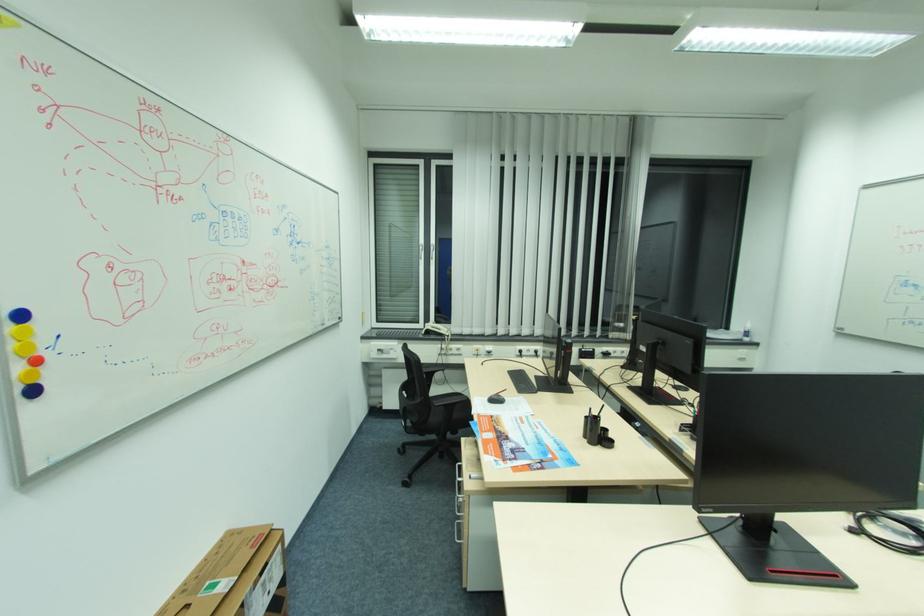
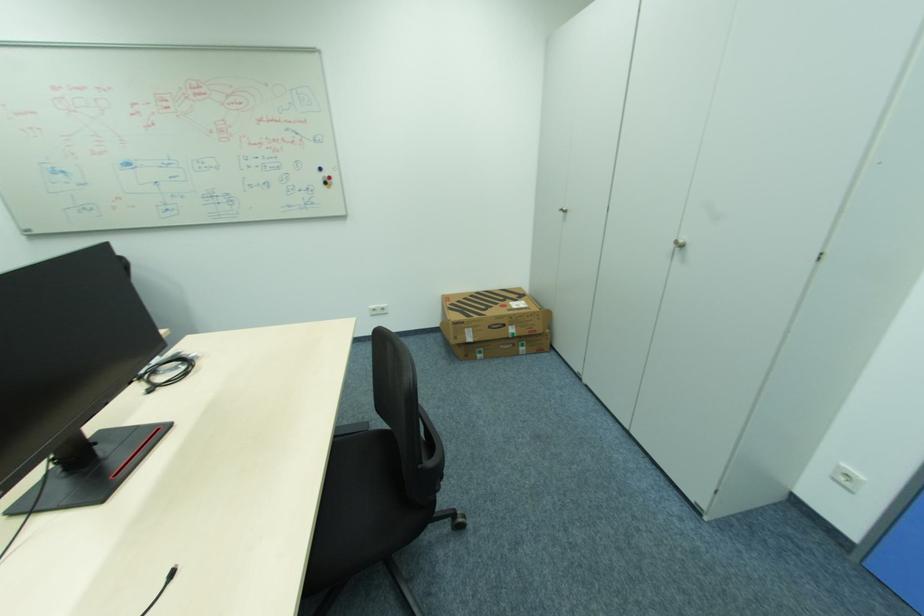
How did the camera likely rotate?

The camera rotated toward right-down.